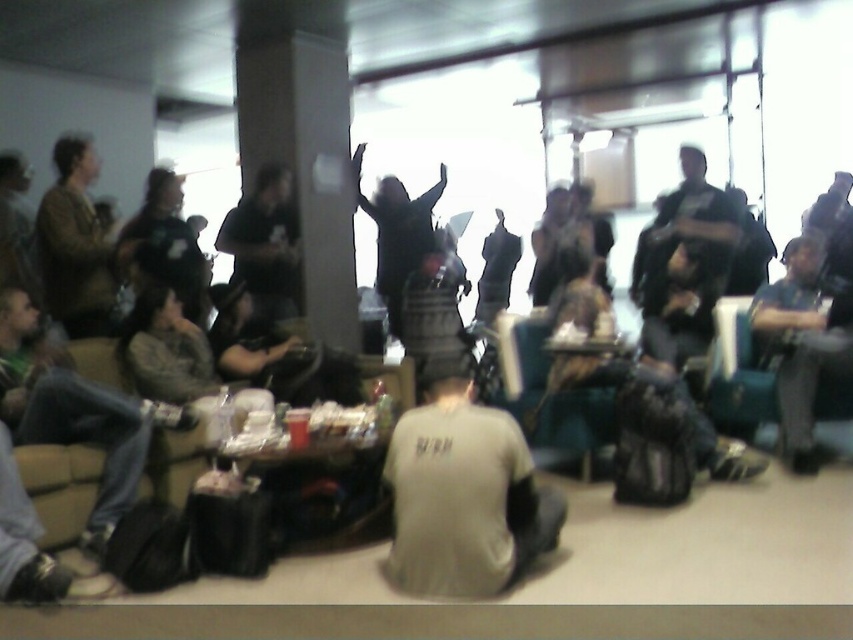
Can you confirm if dark gray fabric jacket at right is positioned to the left of teal fabric armchair at center?

In fact, dark gray fabric jacket at right is to the right of teal fabric armchair at center.

Does dark gray fabric jacket at right appear on the right side of teal fabric armchair at center?

Yes, dark gray fabric jacket at right is to the right of teal fabric armchair at center.

Between point (799, 252) and point (514, 330), which one is positioned behind?

Positioned behind is point (799, 252).

Locate an element on the screen. The width and height of the screenshot is (853, 640). dark gray fabric jacket at right is located at coordinates (802, 342).

Can you confirm if dark gray fabric jacket at lower left is taller than brown textured jacket at left?

Incorrect, dark gray fabric jacket at lower left's height is not larger of brown textured jacket at left's.

Does dark gray fabric jacket at lower left have a greater width compared to brown textured jacket at left?

Correct, the width of dark gray fabric jacket at lower left exceeds that of brown textured jacket at left.

Locate an element on the screen. The height and width of the screenshot is (640, 853). dark gray fabric jacket at lower left is located at coordinates (76, 413).

Can you confirm if brown textured jacket at left is positioned to the right of teal fabric armchair at center?

No, brown textured jacket at left is not to the right of teal fabric armchair at center.

Where is `brown textured jacket at left`? brown textured jacket at left is located at coordinates (76, 244).

Is point (113, 314) closer to camera compared to point (553, 394)?

No, (113, 314) is further to viewer.

Image resolution: width=853 pixels, height=640 pixels. Identify the location of brown textured jacket at left. (76, 244).